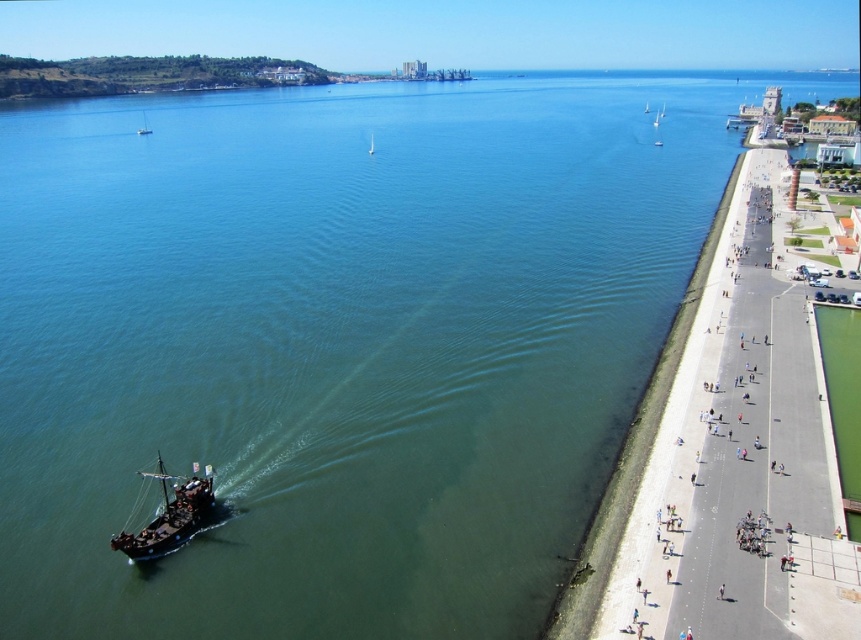
Question: Does wooden ship at lower left appear over white glossy sailboat at center?

Choices:
 (A) no
 (B) yes

Answer: (A)

Question: Considering the real-world distances, which object is closest to the white glossy sailboat at center?

Choices:
 (A) wooden sailboat at upper center
 (B) wooden ship at lower left

Answer: (A)

Question: Considering the real-world distances, which object is closest to the white glossy sailboat at center?

Choices:
 (A) wooden ship at lower left
 (B) wooden sailboat at upper center

Answer: (B)

Question: In this image, where is wooden ship at lower left located relative to wooden sailboat at upper center?

Choices:
 (A) left
 (B) right

Answer: (B)

Question: Which of the following is the closest to the observer?

Choices:
 (A) wooden ship at lower left
 (B) white glossy sailboat at center

Answer: (A)

Question: Is wooden ship at lower left bigger than wooden sailboat at upper center?

Choices:
 (A) yes
 (B) no

Answer: (B)